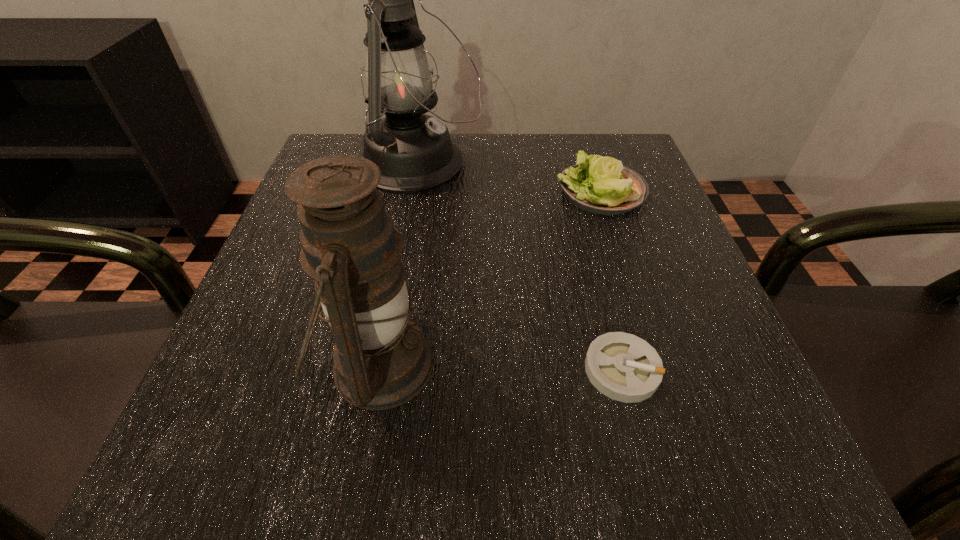
In order to click on oil lamp that is at the far edge in this screenshot , I will do `click(414, 152)`.

At what (x,y) coordinates should I click in order to perform the action: click on lettuce present at the far edge. Please return your answer as a coordinate pair (x, y). Looking at the image, I should click on (601, 185).

Identify the location of object at the near edge. (350, 247).

Find the location of a particular element. lettuce at the right edge is located at coordinates (601, 185).

Where is `ashtray at the right edge`? The width and height of the screenshot is (960, 540). ashtray at the right edge is located at coordinates (622, 366).

Where is `object located in the far left corner section of the desktop`? object located in the far left corner section of the desktop is located at coordinates (414, 152).

Identify the location of object at the near left corner. This screenshot has width=960, height=540. (350, 247).

Where is `object located at the far right corner`? Image resolution: width=960 pixels, height=540 pixels. object located at the far right corner is located at coordinates (601, 185).

You are a GUI agent. You are given a task and a screenshot of the screen. Output one action in this format:
    pyautogui.click(x=<x>, y=<y>)
    Task: Click on the free space at the far edge of the desktop
    Image resolution: width=960 pixels, height=540 pixels.
    Given the screenshot: What is the action you would take?
    pyautogui.click(x=468, y=184)

The height and width of the screenshot is (540, 960). I want to click on free region at the near edge, so click(x=431, y=481).